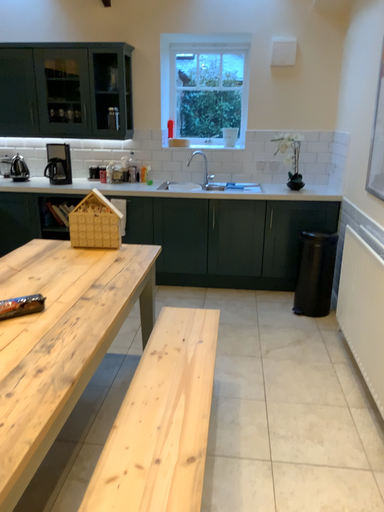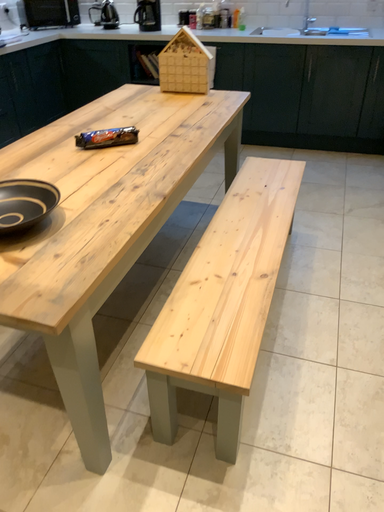
Question: How did the camera likely rotate when shooting the video?

Choices:
 (A) rotated left
 (B) rotated right

Answer: (A)